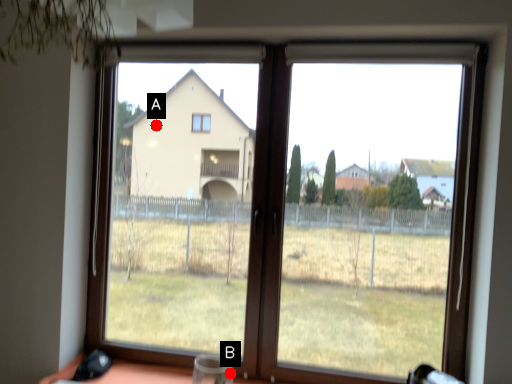
Question: Two points are circled on the image, labeled by A and B beside each circle. Which point is closer to the camera taking this photo?

Choices:
 (A) A is closer
 (B) B is closer

Answer: (B)